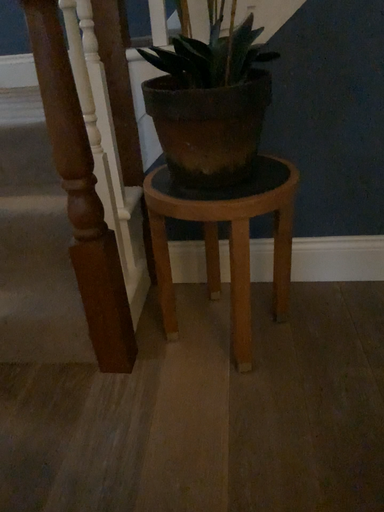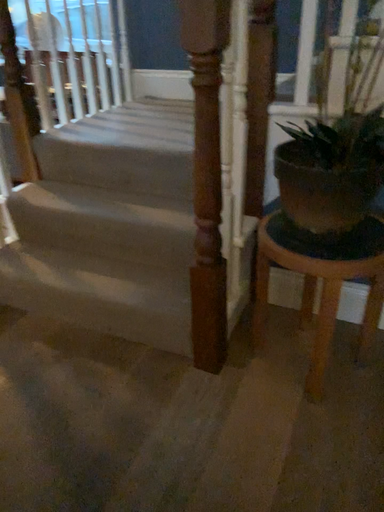
Question: How did the camera likely rotate when shooting the video?

Choices:
 (A) rotated right
 (B) rotated left

Answer: (B)